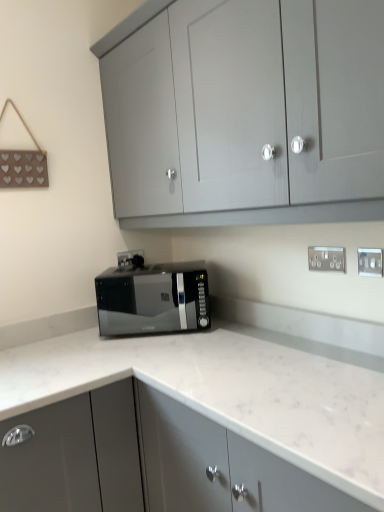
Question: From a real-world perspective, is black glossy microwave at center positioned under white marble countertop at center, the 1th cabinetry from the bottom, based on gravity?

Choices:
 (A) yes
 (B) no

Answer: (B)

Question: Is the position of black glossy microwave at center more distant than that of white marble countertop at center, acting as the 2th cabinetry starting from the top?

Choices:
 (A) yes
 (B) no

Answer: (A)

Question: Is black glossy microwave at center smaller than white marble countertop at center, the 1th cabinetry from the bottom?

Choices:
 (A) no
 (B) yes

Answer: (B)

Question: Are black glossy microwave at center and white marble countertop at center, acting as the 2th cabinetry starting from the top, far apart?

Choices:
 (A) yes
 (B) no

Answer: (B)

Question: Can you confirm if black glossy microwave at center is thinner than white marble countertop at center, acting as the 2th cabinetry starting from the top?

Choices:
 (A) no
 (B) yes

Answer: (B)

Question: In terms of width, does white marble countertop at center, the 1th cabinetry from the bottom, look wider or thinner when compared to black glossy microwave at center?

Choices:
 (A) thin
 (B) wide

Answer: (B)

Question: In terms of height, does white marble countertop at center, acting as the 2th cabinetry starting from the top, look taller or shorter compared to black glossy microwave at center?

Choices:
 (A) tall
 (B) short

Answer: (A)

Question: From the image's perspective, is white marble countertop at center, the 1th cabinetry from the bottom, located above or below black glossy microwave at center?

Choices:
 (A) below
 (B) above

Answer: (A)

Question: From a real-world perspective, relative to black glossy microwave at center, is white marble countertop at center, the 1th cabinetry from the bottom, vertically above or below?

Choices:
 (A) below
 (B) above

Answer: (A)

Question: Would you say black glossy microwave at center is to the left or to the right of silver metallic electric outlet at upper right, acting as the second electric outlet starting from the front, in the picture?

Choices:
 (A) right
 (B) left

Answer: (B)

Question: Considering their positions, is black glossy microwave at center located in front of or behind silver metallic electric outlet at upper right, acting as the second electric outlet starting from the front?

Choices:
 (A) front
 (B) behind

Answer: (B)

Question: Does point (170, 276) appear closer or farther from the camera than point (337, 252)?

Choices:
 (A) farther
 (B) closer

Answer: (A)

Question: Do you think black glossy microwave at center is within silver metallic electric outlet at upper right, the 2th electric outlet positioned from the left, or outside of it?

Choices:
 (A) outside
 (B) inside

Answer: (A)

Question: From the image's perspective, is white plastic electric outlet at upper right, the 3th electric outlet from the left, positioned above or below silver metallic electric outlet at center-right, the 1th electric outlet when ordered from back to front?

Choices:
 (A) above
 (B) below

Answer: (B)

Question: Is white plastic electric outlet at upper right, the 1th electric outlet viewed from the front, in front of or behind silver metallic electric outlet at center-right, which appears as the third electric outlet when viewed from the front, in the image?

Choices:
 (A) behind
 (B) front

Answer: (B)